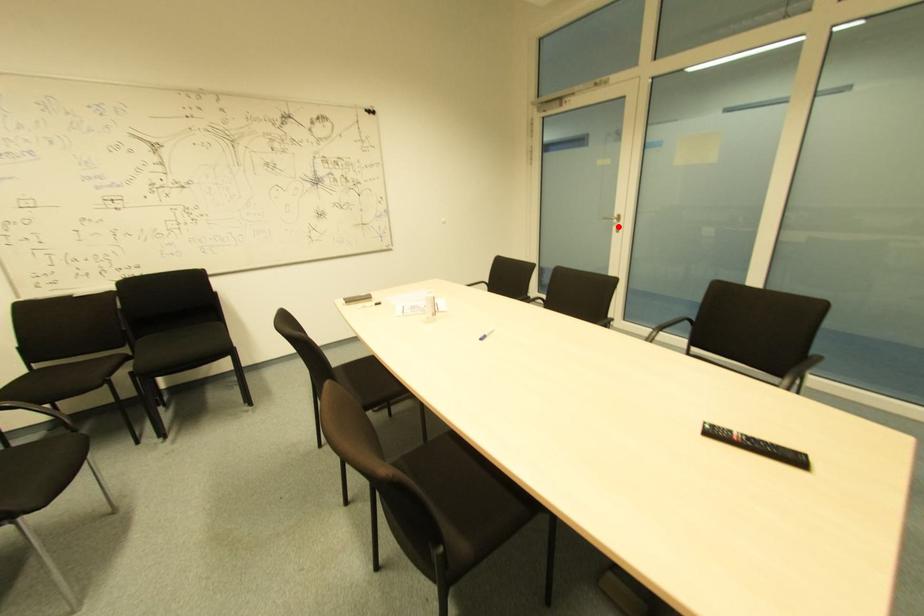
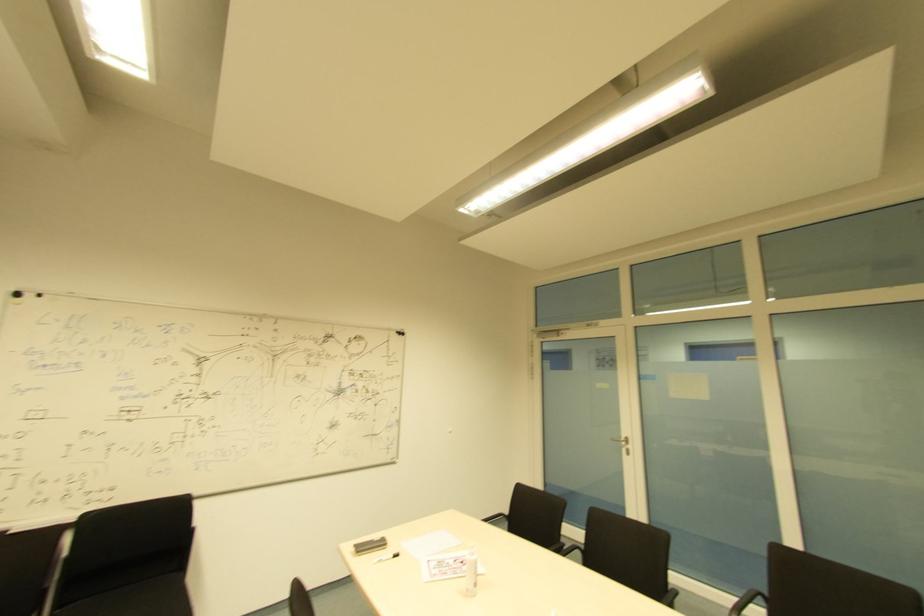
Question: I am providing you with two images of the same scene from different viewpoints. Given a red point in image1, look at the same physical point in image2. Is it:

Choices:
 (A) Closer to the viewpoint
 (B) Farther from the viewpoint

Answer: (B)